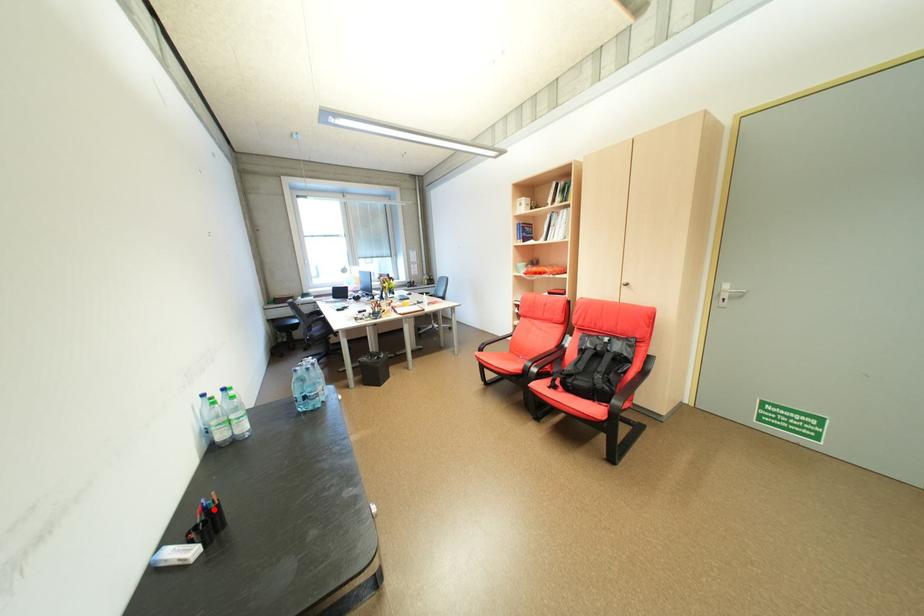
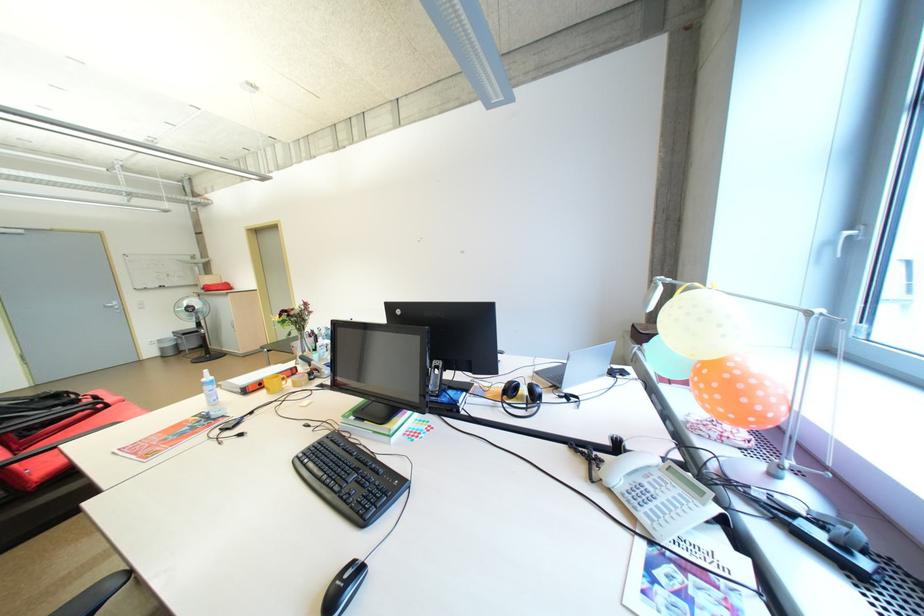
Question: I am providing you with two images of the same scene from different viewpoints. A red point is marked on the first image. Is the red point's position out of view in image 2?

Choices:
 (A) Yes
 (B) No

Answer: (A)